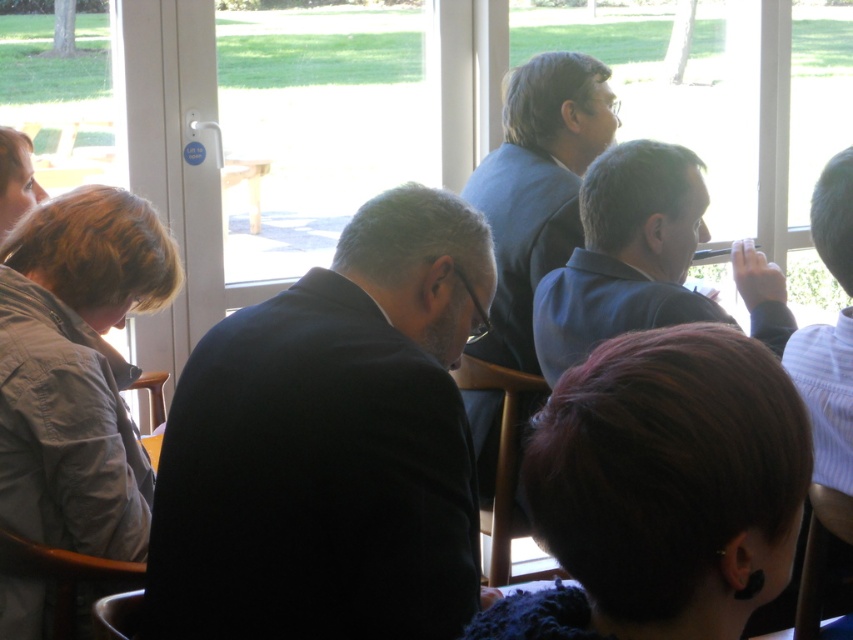
Where is the blue fabric shirt at right located in the image?

The blue fabric shirt at right is located at point [625,253].

You are a photographer trying to capture a candid shot of the blue fabric shirt at right and the white striped shirt at right. The camera you are using has a minimum focus distance of 12 inches. Can you take a photo of both shirts at the same time without moving either shirt?

The blue fabric shirt at right and white striped shirt at right are 13.31 inches apart, which is greater than the camera minimum focus distance of 12 inches. Therefore, you can take a photo of both shirts at the same time without moving either shirt.

You are a photographer standing in the conference room. You want to take a photo of the blue fabric shirt at right and dark brown hair at lower right. Which object is positioned to the left of the other?

The dark brown hair at lower right is positioned to the left of the blue fabric shirt at right.